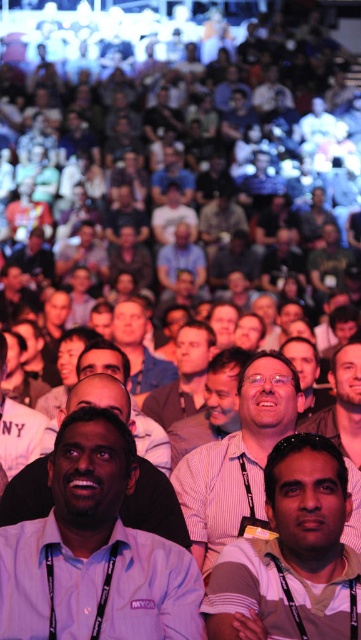
Who is positioned more to the left, striped shirt at center or light brown shirt at center?

Positioned to the left is light brown shirt at center.

I want to click on striped shirt at center, so click(x=211, y=404).

Which is below, striped shirt at center or matte blue shirt at center?

striped shirt at center is below.

Which is more to the left, striped shirt at center or matte blue shirt at center?

From the viewer's perspective, matte blue shirt at center appears more on the left side.

At what (x,y) coordinates should I click in order to perform the action: click on striped shirt at center. Please return your answer as a coordinate pair (x, y). This screenshot has height=640, width=361. Looking at the image, I should click on (211, 404).

Is striped cotton shirt at center below matte blue shirt at center?

Yes.

I want to click on striped cotton shirt at center, so [x=293, y=552].